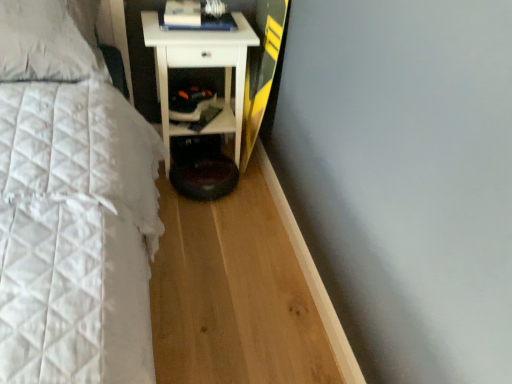
Question: Is there a large distance between white quilted pillow at upper left and white glossy cabinet at lower center?

Choices:
 (A) yes
 (B) no

Answer: (B)

Question: Considering the relative sizes of white quilted pillow at upper left and white glossy cabinet at lower center in the image provided, is white quilted pillow at upper left smaller than white glossy cabinet at lower center?

Choices:
 (A) no
 (B) yes

Answer: (A)

Question: From a real-world perspective, is white quilted pillow at upper left below white glossy cabinet at lower center?

Choices:
 (A) yes
 (B) no

Answer: (B)

Question: From the image's perspective, does white quilted pillow at upper left appear lower than white glossy cabinet at lower center?

Choices:
 (A) yes
 (B) no

Answer: (B)

Question: Is white quilted pillow at upper left taller than white glossy cabinet at lower center?

Choices:
 (A) yes
 (B) no

Answer: (A)

Question: Considering the relative sizes of white quilted pillow at upper left and white glossy cabinet at lower center in the image provided, is white quilted pillow at upper left shorter than white glossy cabinet at lower center?

Choices:
 (A) yes
 (B) no

Answer: (B)

Question: Considering the relative sizes of white glossy cabinet at lower center and white glossy nightstand at center in the image provided, is white glossy cabinet at lower center shorter than white glossy nightstand at center?

Choices:
 (A) yes
 (B) no

Answer: (A)

Question: Is white glossy cabinet at lower center positioned beyond the bounds of white glossy nightstand at center?

Choices:
 (A) yes
 (B) no

Answer: (B)

Question: Can you confirm if white glossy cabinet at lower center is positioned to the left of white glossy nightstand at center?

Choices:
 (A) yes
 (B) no

Answer: (A)

Question: Would you consider white glossy cabinet at lower center to be distant from white glossy nightstand at center?

Choices:
 (A) no
 (B) yes

Answer: (A)

Question: Is white glossy nightstand at center a part of white glossy cabinet at lower center?

Choices:
 (A) yes
 (B) no

Answer: (B)

Question: Can you confirm if white glossy cabinet at lower center is positioned to the right of white glossy nightstand at center?

Choices:
 (A) yes
 (B) no

Answer: (B)

Question: Does hardcover book at upper center have a smaller size compared to white glossy cabinet at lower center?

Choices:
 (A) no
 (B) yes

Answer: (B)